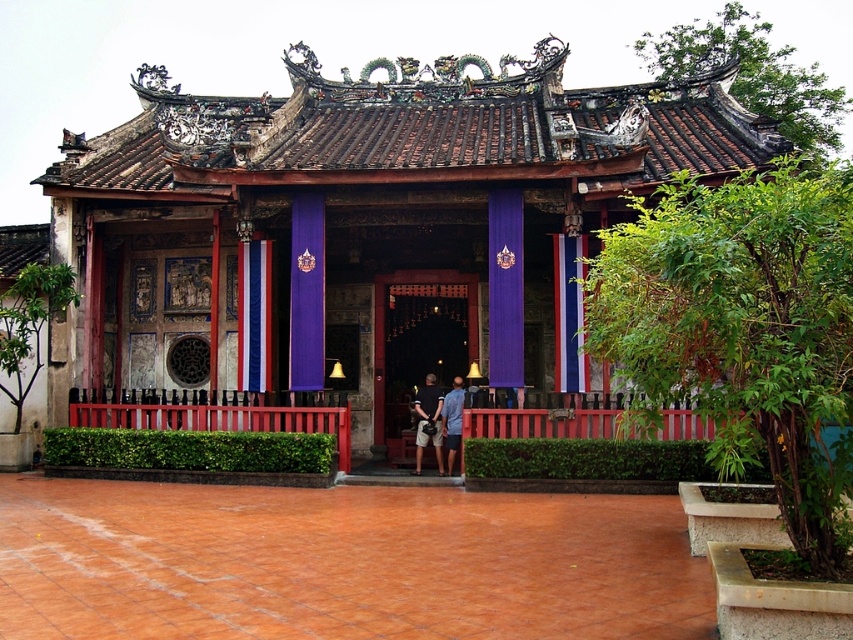
Is polished wood temple at center smaller than blue denim shorts at center?

No.

Does point (83, 237) lie in front of point (450, 426)?

That is False.

Who is more distant from viewer, [456,321] or [457,392]?

The point [456,321] is more distant.

I want to click on polished wood temple at center, so (x=366, y=224).

Does polished wood temple at center appear under polished wood door at center?

Actually, polished wood temple at center is above polished wood door at center.

Which is in front, point (135, 244) or point (373, 380)?

Positioned in front is point (373, 380).

You are a GUI agent. You are given a task and a screenshot of the screen. Output one action in this format:
    pyautogui.click(x=<x>, y=<y>)
    Task: Click on the polished wood temple at center
    
    Given the screenshot: What is the action you would take?
    pyautogui.click(x=366, y=224)

Looking at this image, is matte gray shirt at center further to the viewer compared to blue denim shorts at center?

Yes, it is.

Can you confirm if matte gray shirt at center is smaller than blue denim shorts at center?

Indeed, matte gray shirt at center has a smaller size compared to blue denim shorts at center.

Is point (434, 426) positioned after point (459, 422)?

Yes.

Image resolution: width=853 pixels, height=640 pixels. I want to click on matte gray shirt at center, so click(428, 420).